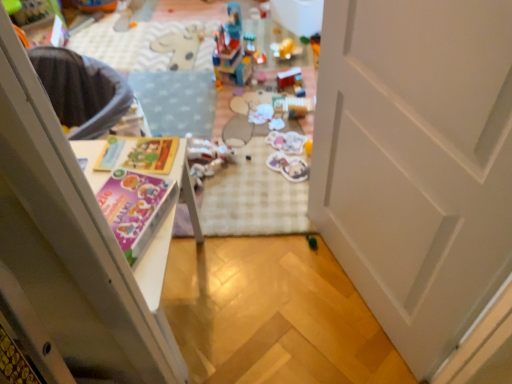
Describe the element at coordinates (152, 155) in the screenshot. I see `matte paper magazine at center` at that location.

You are a GUI agent. You are given a task and a screenshot of the screen. Output one action in this format:
    pyautogui.click(x=<x>, y=<y>)
    Task: Click on the smooth plastic toy at center, the fifth toy when ordered from bottom to top
    The width and height of the screenshot is (512, 384).
    Given the screenshot: What is the action you would take?
    pyautogui.click(x=287, y=77)

Can you confirm if green matte toy at center, positioned as the sixth toy in top-to-bottom order, is bigger than matte paper magazine at center?

Actually, green matte toy at center, positioned as the sixth toy in top-to-bottom order, might be smaller than matte paper magazine at center.

From the image's perspective, is green matte toy at center, positioned as the sixth toy in top-to-bottom order, positioned above or below matte paper magazine at center?

Clearly, from the image's perspective, green matte toy at center, positioned as the sixth toy in top-to-bottom order, is below matte paper magazine at center.

Is green matte toy at center, positioned as the sixth toy in top-to-bottom order, completely or partially outside of matte paper magazine at center?

Yes, green matte toy at center, positioned as the sixth toy in top-to-bottom order, is not within matte paper magazine at center.

From a real-world perspective, who is located higher, green matte toy at center, positioned as the 1th toy in bottom-to-top order, or matte paper magazine at center?

From a 3D spatial view, matte paper magazine at center is above.

Looking at their sizes, would you say matte purple book at left is wider or thinner than white matte door at center?

In the image, matte purple book at left appears to be wider than white matte door at center.

Is matte purple book at left facing towards white matte door at center?

Yes, matte purple book at left is aimed at white matte door at center.

Is point (128, 206) positioned after point (486, 113)?

Yes, it is behind point (486, 113).

From a real-world perspective, between matte purple book at left and white matte door at center, who is vertically higher?

white matte door at center, from a real-world perspective.

Which is less distant, (144, 153) or (290, 77)?

Point (144, 153)

From a real-world perspective, between matte paper magazine at center and smooth plastic toy at center, the fifth toy when ordered from bottom to top, who is vertically higher?

From a 3D spatial view, matte paper magazine at center is above.

From the image's perspective, between matte paper magazine at center and smooth plastic toy at center, the fifth toy when ordered from bottom to top, which one is located above?

smooth plastic toy at center, the fifth toy when ordered from bottom to top.

Can you tell me how much matte paper magazine at center and smooth plastic toy at center, the fifth toy when ordered from bottom to top, differ in facing direction?

There is a 121-degree angle between the facing directions of matte paper magazine at center and smooth plastic toy at center, the fifth toy when ordered from bottom to top.

How many degrees apart are the facing directions of white matte door at center and translucent plastic toy at center, placed as the 4th toy when sorted from top to bottom?

white matte door at center and translucent plastic toy at center, placed as the 4th toy when sorted from top to bottom, are facing 34.7 degrees away from each other.

From a real-world perspective, which object rests below the other?

translucent plastic toy at center, placed as the 4th toy when sorted from top to bottom, is physically lower.

Between white matte door at center and translucent plastic toy at center, placed as the third toy when sorted from bottom to top, which one is positioned behind?

translucent plastic toy at center, placed as the third toy when sorted from bottom to top, is more distant.

Is white matte door at center wider than translucent plastic toy at center, placed as the third toy when sorted from bottom to top?

Incorrect, the width of white matte door at center does not surpass that of translucent plastic toy at center, placed as the third toy when sorted from bottom to top.

Considering the points (298, 180) and (249, 68), which point is behind, point (298, 180) or point (249, 68)?

Point (249, 68)

Is matte plastic stickers at center, the second toy from the bottom, positioned in front of brick-like plastic toy at center, placed as the sixth toy when sorted from bottom to top?

Yes, it is in front of brick-like plastic toy at center, placed as the sixth toy when sorted from bottom to top.

Measure the distance between matte plastic stickers at center, which ranks as the fifth toy in top-to-bottom order, and brick-like plastic toy at center, placed as the sixth toy when sorted from bottom to top.

matte plastic stickers at center, which ranks as the fifth toy in top-to-bottom order, is 29.02 inches from brick-like plastic toy at center, placed as the sixth toy when sorted from bottom to top.

Can you see matte plastic stickers at center, which ranks as the fifth toy in top-to-bottom order, touching brick-like plastic toy at center, which appears as the first toy when viewed from the top?

No, matte plastic stickers at center, which ranks as the fifth toy in top-to-bottom order, is not in contact with brick-like plastic toy at center, which appears as the first toy when viewed from the top.

Can you confirm if matte purple book at left is positioned to the right of translucent plastic stickers at center, arranged as the third toy when viewed from the top?

In fact, matte purple book at left is to the left of translucent plastic stickers at center, arranged as the third toy when viewed from the top.

Between matte purple book at left and translucent plastic stickers at center, the 4th toy from the bottom, which one is positioned in front?

matte purple book at left is in front.

Based on the photo, which of these two, matte purple book at left or translucent plastic stickers at center, the 4th toy from the bottom, is thinner?

translucent plastic stickers at center, the 4th toy from the bottom.

Which is in front, point (207, 140) or point (272, 131)?

The point (207, 140) is in front.

From the image's perspective, relative to translucent plastic stickers at center, the 4th toy from the bottom, is translucent plastic toy at center, placed as the third toy when sorted from bottom to top, above or below?

translucent plastic toy at center, placed as the third toy when sorted from bottom to top, is situated lower than translucent plastic stickers at center, the 4th toy from the bottom, in the image.

From the picture: Considering the relative positions of translucent plastic toy at center, placed as the 4th toy when sorted from top to bottom, and translucent plastic stickers at center, the 4th toy from the bottom, in the image provided, is translucent plastic toy at center, placed as the 4th toy when sorted from top to bottom, to the left of translucent plastic stickers at center, the 4th toy from the bottom, from the viewer's perspective?

Correct, you'll find translucent plastic toy at center, placed as the 4th toy when sorted from top to bottom, to the left of translucent plastic stickers at center, the 4th toy from the bottom.

From a real-world perspective, is translucent plastic toy at center, placed as the third toy when sorted from bottom to top, positioned under translucent plastic stickers at center, arranged as the third toy when viewed from the top, based on gravity?

No, from a real-world perspective, translucent plastic toy at center, placed as the third toy when sorted from bottom to top, is not beneath translucent plastic stickers at center, arranged as the third toy when viewed from the top.

You are a GUI agent. You are given a task and a screenshot of the screen. Output one action in this format:
    pyautogui.click(x=<x>, y=<y>)
    Task: Click on the 6th toy directly beneath the matte paper magazine at center (from a real-world perspective)
    Image resolution: width=512 pixels, height=384 pixels.
    Given the screenshot: What is the action you would take?
    pyautogui.click(x=311, y=241)

Locate an element on the screen. Image resolution: width=512 pixels, height=384 pixels. door above the matte purple book at left (from a real-world perspective) is located at coordinates (416, 162).

Estimate the real-world distances between objects in this image. Which object is closer to matte paper magazine at center, matte purple book at left or translucent plastic stickers at center, arranged as the third toy when viewed from the top?

matte purple book at left is closer to matte paper magazine at center.

Based on their spatial positions, is matte purple book at left or brick-like plastic toy at center, placed as the sixth toy when sorted from bottom to top, further from smooth plastic toy at center, the fifth toy when ordered from bottom to top?

matte purple book at left lies further to smooth plastic toy at center, the fifth toy when ordered from bottom to top, than the other object.

When comparing their distances from green matte toy at center, positioned as the 1th toy in bottom-to-top order, does matte paper magazine at center or matte purple book at left seem closer?

matte paper magazine at center is positioned closer to the anchor green matte toy at center, positioned as the 1th toy in bottom-to-top order.

Considering their positions, is matte plastic stickers at center, which ranks as the fifth toy in top-to-bottom order, positioned closer to matte purple book at left than brick-like plastic toy at center, placed as the sixth toy when sorted from bottom to top?

The object closer to matte purple book at left is matte plastic stickers at center, which ranks as the fifth toy in top-to-bottom order.

Based on their spatial positions, is matte paper magazine at center or brick-like plastic toy at center, placed as the sixth toy when sorted from bottom to top, further from green matte toy at center, positioned as the sixth toy in top-to-bottom order?

The object further to green matte toy at center, positioned as the sixth toy in top-to-bottom order, is brick-like plastic toy at center, placed as the sixth toy when sorted from bottom to top.

Looking at the image, which one is located further to translucent plastic stickers at center, arranged as the third toy when viewed from the top, white matte door at center or matte purple book at left?

matte purple book at left is positioned further to the anchor translucent plastic stickers at center, arranged as the third toy when viewed from the top.

From the image, which object appears to be farther from matte plastic stickers at center, which ranks as the fifth toy in top-to-bottom order, brick-like plastic toy at center, which appears as the first toy when viewed from the top, or smooth plastic toy at center, arranged as the second toy when viewed from the top?

brick-like plastic toy at center, which appears as the first toy when viewed from the top.

From the image, which object appears to be nearer to green matte toy at center, positioned as the 1th toy in bottom-to-top order, translucent plastic toy at center, placed as the 4th toy when sorted from top to bottom, or smooth plastic toy at center, the fifth toy when ordered from bottom to top?

translucent plastic toy at center, placed as the 4th toy when sorted from top to bottom, is positioned closer to the anchor green matte toy at center, positioned as the 1th toy in bottom-to-top order.

This screenshot has height=384, width=512. In order to click on book positioned between white matte door at center and brick-like plastic toy at center, which appears as the first toy when viewed from the top, from near to far in this screenshot , I will do `click(135, 208)`.

The image size is (512, 384). What are the coordinates of `book positioned between white matte door at center and translucent plastic toy at center, placed as the 4th toy when sorted from top to bottom, from near to far` in the screenshot? It's located at (135, 208).

At what (x,y) coordinates should I click in order to perform the action: click on book positioned between white matte door at center and matte plastic stickers at center, which ranks as the fifth toy in top-to-bottom order, from near to far. Please return your answer as a coordinate pair (x, y). The width and height of the screenshot is (512, 384). Looking at the image, I should click on (135, 208).

At what (x,y) coordinates should I click in order to perform the action: click on toy that lies between brick-like plastic toy at center, placed as the sixth toy when sorted from bottom to top, and translucent plastic stickers at center, the 4th toy from the bottom, from top to bottom. Please return your answer as a coordinate pair (x, y). The image size is (512, 384). Looking at the image, I should click on (287, 77).